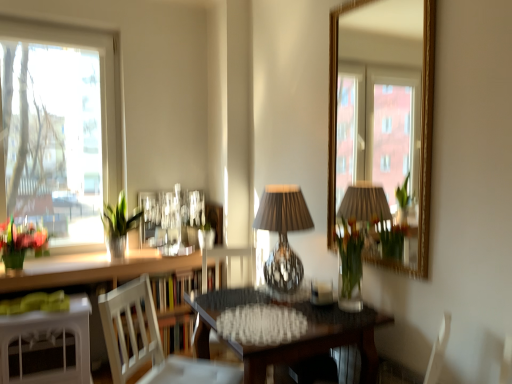
In order to click on shiny glass table lamp at center in this screenshot , I will do `click(283, 234)`.

The image size is (512, 384). Describe the element at coordinates (149, 342) in the screenshot. I see `white wood chair at center, which is the second chair from back to front` at that location.

What do you see at coordinates (118, 226) in the screenshot? I see `green glass vase at left` at bounding box center [118, 226].

I want to click on white wood chair at center, the 2th chair positioned from the front, so click(x=227, y=262).

Looking at this image, what is the approximate width of clear glass window at left?

clear glass window at left is 3.88 inches in width.

Identify the location of shiny glass table lamp at center. The height and width of the screenshot is (384, 512). (283, 234).

Does white wood table at lower left, the 1th table in the left-to-right sequence, have a greater width compared to white wood chair at center, which appears as the 1th chair when viewed from the back?

Incorrect, the width of white wood table at lower left, the 1th table in the left-to-right sequence, does not surpass that of white wood chair at center, which appears as the 1th chair when viewed from the back.

Is white wood table at lower left, placed as the 2th table when sorted from right to left, positioned with its back to white wood chair at center, the 2th chair positioned from the front?

white wood table at lower left, placed as the 2th table when sorted from right to left, is not turned away from white wood chair at center, the 2th chair positioned from the front.

Which chair is the 2nd one when counting from the right side of the white wood table at lower left, placed as the 2th table when sorted from right to left? Please provide its 2D coordinates.

[(227, 262)]

Does white wood table at lower left, the 1th table in the left-to-right sequence, have a lesser height compared to white wood chair at center, which appears as the 1th chair when viewed from the back?

Indeed, white wood table at lower left, the 1th table in the left-to-right sequence, has a lesser height compared to white wood chair at center, which appears as the 1th chair when viewed from the back.

The width and height of the screenshot is (512, 384). In order to click on the 2nd chair counting from the left of the wooden textured table at center, placed as the 1th table when sorted from right to left in this screenshot , I will do `click(149, 342)`.

Between white wood chair at center, the 1th chair positioned from the front, and wooden textured table at center, placed as the 1th table when sorted from right to left, which one has more height?

Standing taller between the two is wooden textured table at center, placed as the 1th table when sorted from right to left.

Would you say white wood chair at center, the 1th chair positioned from the front, contains wooden textured table at center, placed as the 1th table when sorted from right to left?

No, wooden textured table at center, placed as the 1th table when sorted from right to left, is located outside of white wood chair at center, the 1th chair positioned from the front.

Between white wood chair at center, which is the second chair from back to front, and wooden textured table at center, which appears as the 2th table when viewed from the left, which one appears on the left side from the viewer's perspective?

Positioned to the left is white wood chair at center, which is the second chair from back to front.

From a real-world perspective, is green glass vase at left positioned above or below vibrant floral bouquet at left?

green glass vase at left is above vibrant floral bouquet at left.

In the image, is green glass vase at left positioned in front of or behind vibrant floral bouquet at left?

green glass vase at left is positioned farther from the viewer than vibrant floral bouquet at left.

Considering the sizes of green glass vase at left and vibrant floral bouquet at left in the image, is green glass vase at left bigger or smaller than vibrant floral bouquet at left?

Clearly, green glass vase at left is smaller in size than vibrant floral bouquet at left.

Could you tell me if green glass vase at left is turned towards vibrant floral bouquet at left?

No, green glass vase at left does not turn towards vibrant floral bouquet at left.

Is green glass vase at left far from white wood table at lower left, placed as the 2th table when sorted from right to left?

No.

Is white wood table at lower left, the 1th table in the left-to-right sequence, at the back of green glass vase at left?

That's not correct — green glass vase at left is not looking away from white wood table at lower left, the 1th table in the left-to-right sequence.

Is green glass vase at left positioned beyond the bounds of white wood table at lower left, placed as the 2th table when sorted from right to left?

Yes, green glass vase at left is located beyond the bounds of white wood table at lower left, placed as the 2th table when sorted from right to left.

Where is `houseplant lying behind the white wood table at lower left, the 1th table in the left-to-right sequence`? houseplant lying behind the white wood table at lower left, the 1th table in the left-to-right sequence is located at coordinates (118, 226).

Considering the relative sizes of wooden textured table at center, which appears as the 2th table when viewed from the left, and shiny glass table lamp at center in the image provided, is wooden textured table at center, which appears as the 2th table when viewed from the left, taller than shiny glass table lamp at center?

Yes, wooden textured table at center, which appears as the 2th table when viewed from the left, is taller than shiny glass table lamp at center.

In terms of size, does wooden textured table at center, which appears as the 2th table when viewed from the left, appear bigger or smaller than shiny glass table lamp at center?

Clearly, wooden textured table at center, which appears as the 2th table when viewed from the left, is larger in size than shiny glass table lamp at center.

Looking at this image, would you consider wooden textured table at center, placed as the 1th table when sorted from right to left, to be distant from shiny glass table lamp at center?

No, wooden textured table at center, placed as the 1th table when sorted from right to left, is not far from shiny glass table lamp at center.

In the image, is wooden textured table at center, placed as the 1th table when sorted from right to left, on the left side or the right side of shiny glass table lamp at center?

Clearly, wooden textured table at center, placed as the 1th table when sorted from right to left, is on the left of shiny glass table lamp at center in the image.

Locate an element on the screen. This screenshot has width=512, height=384. the 1st table counting from the right side of the clear glass window at left is located at coordinates (49, 338).

Looking at this image, could you tell me if clear glass window at left is facing white wood table at lower left, the 1th table in the left-to-right sequence?

No.

Which of these two, clear glass window at left or white wood table at lower left, placed as the 2th table when sorted from right to left, stands taller?

clear glass window at left is taller.

Considering the sizes of objects clear glass window at left and white wood table at lower left, the 1th table in the left-to-right sequence, in the image provided, who is thinner, clear glass window at left or white wood table at lower left, the 1th table in the left-to-right sequence,?

clear glass window at left.

Image resolution: width=512 pixels, height=384 pixels. I want to click on chair that is the 2nd one below the shiny glass table lamp at center (from a real-world perspective), so click(x=227, y=262).

From their relative heights in the image, would you say shiny glass table lamp at center is taller or shorter than white wood chair at center, the 2th chair positioned from the front?

Clearly, shiny glass table lamp at center is shorter compared to white wood chair at center, the 2th chair positioned from the front.

Is shiny glass table lamp at center surrounding white wood chair at center, the 2th chair positioned from the front?

No, white wood chair at center, the 2th chair positioned from the front, is not a part of shiny glass table lamp at center.

Which is farther from the camera, (280, 237) or (253, 271)?

Positioned behind is point (253, 271).

This screenshot has height=384, width=512. Identify the location of table located on the left of white wood chair at center, which appears as the 1th chair when viewed from the back. (49, 338).

I want to click on the 1st table located beneath the white wood chair at center, the 1th chair positioned from the front (from a real-world perspective), so click(x=319, y=341).

From the image, which object appears to be nearer to white wood chair at center, the 1th chair positioned from the front, wooden textured table at center, which appears as the 2th table when viewed from the left, or vibrant floral bouquet at left?

Based on the image, wooden textured table at center, which appears as the 2th table when viewed from the left, appears to be nearer to white wood chair at center, the 1th chair positioned from the front.

When comparing their distances from clear glass window at left, does white wood chair at center, which appears as the 1th chair when viewed from the back, or white wood chair at center, which is the second chair from back to front, seem further?

white wood chair at center, which is the second chair from back to front, is positioned further to the anchor clear glass window at left.

Estimate the real-world distances between objects in this image. Which object is further from white wood table at lower left, the 1th table in the left-to-right sequence, translucent glass vase at center or white wood chair at center, which appears as the 1th chair when viewed from the back?

Among the two, translucent glass vase at center is located further to white wood table at lower left, the 1th table in the left-to-right sequence.

Looking at the image, which one is located closer to white wood chair at center, which is the second chair from back to front, white wood table at lower left, placed as the 2th table when sorted from right to left, or translucent glass vase at center?

The object closer to white wood chair at center, which is the second chair from back to front, is white wood table at lower left, placed as the 2th table when sorted from right to left.

When comparing their distances from green glass vase at left, does vibrant floral bouquet at left or clear glass window at left seem closer?

vibrant floral bouquet at left.

Based on their spatial positions, is wooden textured table at center, placed as the 1th table when sorted from right to left, or white wood chair at center, the 2th chair positioned from the front, closer to white wood table at lower left, the 1th table in the left-to-right sequence?

white wood chair at center, the 2th chair positioned from the front, is positioned closer to the anchor white wood table at lower left, the 1th table in the left-to-right sequence.

Which object lies further to the anchor point vibrant floral bouquet at left, green glass vase at left or white wood table at lower left, placed as the 2th table when sorted from right to left?

white wood table at lower left, placed as the 2th table when sorted from right to left, is further to vibrant floral bouquet at left.

From the image, which object appears to be nearer to white wood chair at center, which is the second chair from back to front, clear glass window at left or white glossy counter top at lower left?

white glossy counter top at lower left is closer to white wood chair at center, which is the second chair from back to front.

Locate an element on the screen. counter top between wooden textured table at center, placed as the 1th table when sorted from right to left, and green glass vase at left in the front-back direction is located at coordinates (93, 269).

Identify the location of houseplant situated between clear glass window at left and wooden textured table at center, placed as the 1th table when sorted from right to left, from left to right. Image resolution: width=512 pixels, height=384 pixels. (118, 226).

The width and height of the screenshot is (512, 384). I want to click on window between vibrant floral bouquet at left and white wood chair at center, which appears as the 1th chair when viewed from the back, in the horizontal direction, so click(x=59, y=130).

You are a GUI agent. You are given a task and a screenshot of the screen. Output one action in this format:
    pyautogui.click(x=<x>, y=<y>)
    Task: Click on the counter top located between vibrant floral bouquet at left and wooden textured table at center, which appears as the 2th table when viewed from the left, in the left-right direction
    The height and width of the screenshot is (384, 512).
    Given the screenshot: What is the action you would take?
    pyautogui.click(x=93, y=269)